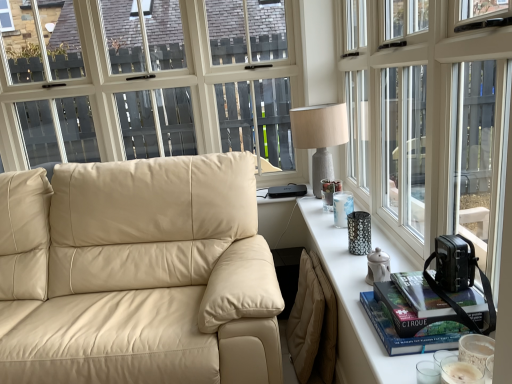
Question: Considering the positions of beige leather couch at left and hardcover book at right, which appears as the first book when viewed from the top, in the image, is beige leather couch at left wider or thinner than hardcover book at right, which appears as the first book when viewed from the top,?

Choices:
 (A) wide
 (B) thin

Answer: (A)

Question: Is point click(20, 322) positioned closer to the camera than point click(428, 299)?

Choices:
 (A) closer
 (B) farther

Answer: (B)

Question: Estimate the real-world distances between objects in this image. Which object is closer to the white glossy table at right?

Choices:
 (A) transparent glass window at upper right
 (B) hardcover book at right, the second book viewed from the top
 (C) hardcover book at right, arranged as the second book when ordered from the bottom
 (D) textured gray lamp at upper right
 (E) beige leather couch at left

Answer: (B)

Question: Which object is positioned closest to the textured gray lamp at upper right?

Choices:
 (A) beige leather couch at left
 (B) white glossy table at right
 (C) hardcover book at right, arranged as the second book when ordered from the bottom
 (D) transparent glass window at upper right
 (E) hardcover book at right, the second book viewed from the top

Answer: (D)